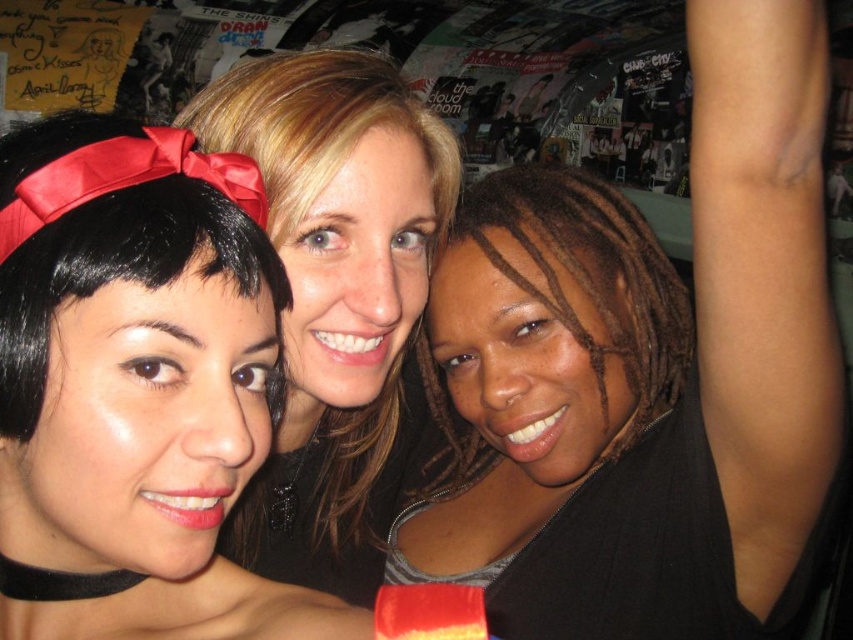
Measure the distance between black satin headband at left and black hair at center.

A distance of 8.55 inches exists between black satin headband at left and black hair at center.

Is black satin headband at left above black hair at center?

No, black satin headband at left is not above black hair at center.

This screenshot has width=853, height=640. Describe the element at coordinates (142, 419) in the screenshot. I see `black satin headband at left` at that location.

Image resolution: width=853 pixels, height=640 pixels. Identify the location of black satin headband at left. pyautogui.click(x=142, y=419).

Based on the photo, who is taller, black matte hair at upper center or black satin headband at left?

black matte hair at upper center is taller.

Does point (654, 404) lie in front of point (146, 291)?

No, (654, 404) is behind (146, 291).

Between point (616, 324) and point (90, 536), which one is positioned in front?

Point (90, 536)

You are a GUI agent. You are given a task and a screenshot of the screen. Output one action in this format:
    pyautogui.click(x=<x>, y=<y>)
    Task: Click on the black matte hair at upper center
    This screenshot has width=853, height=640.
    Given the screenshot: What is the action you would take?
    pyautogui.click(x=648, y=371)

Which is in front, point (701, 444) or point (341, 134)?

Point (341, 134) is more forward.

Does black matte hair at upper center have a lesser width compared to black hair at center?

No, black matte hair at upper center is not thinner than black hair at center.

What do you see at coordinates (648, 371) in the screenshot?
I see `black matte hair at upper center` at bounding box center [648, 371].

At what (x,y) coordinates should I click in order to perform the action: click on black matte hair at upper center. Please return your answer as a coordinate pair (x, y). The height and width of the screenshot is (640, 853). Looking at the image, I should click on (648, 371).